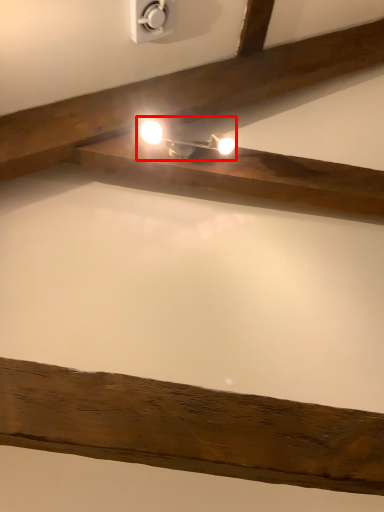
Question: Where is light fixture (annotated by the red box) located in relation to power plugs and sockets in the image?

Choices:
 (A) right
 (B) left

Answer: (A)